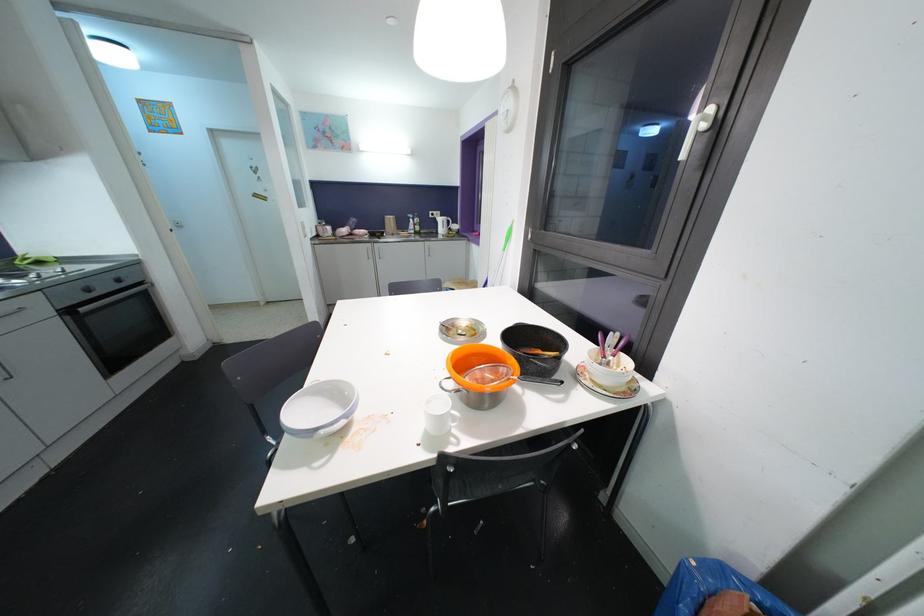
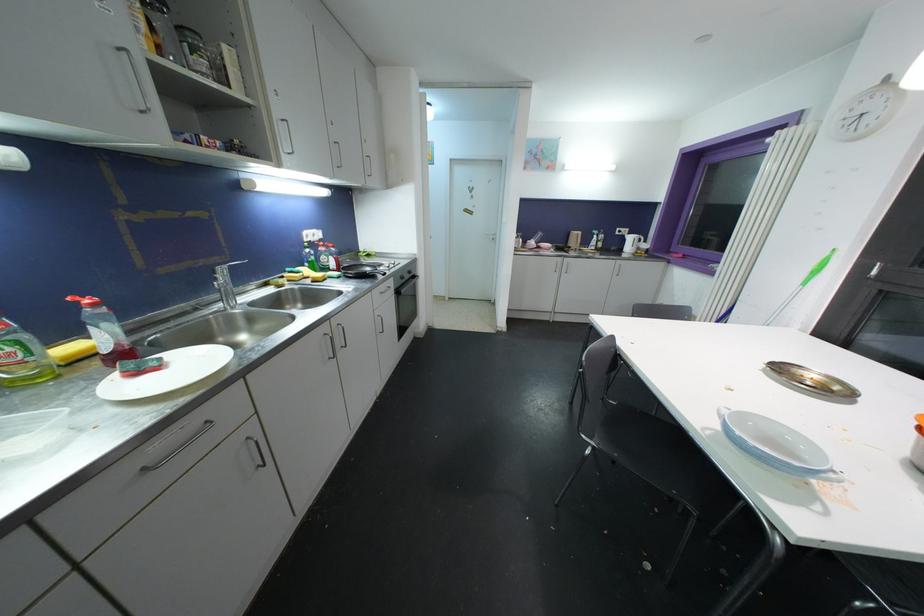
The point at (444, 223) is marked in the first image. Where is the corresponding point in the second image?

(634, 241)